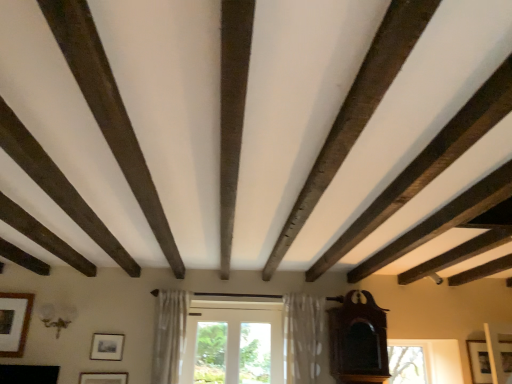
Question: From a real-world perspective, does matte gold picture frame at lower center, which ranks as the third picture frame in left-to-right order, sit lower than mahogany wood grandfather clock at right?

Choices:
 (A) no
 (B) yes

Answer: (B)

Question: From a real-world perspective, is matte gold picture frame at lower center, the 2th picture frame from the right, on mahogany wood grandfather clock at right?

Choices:
 (A) no
 (B) yes

Answer: (A)

Question: Does matte gold picture frame at lower center, the 2th picture frame from the right, come behind mahogany wood grandfather clock at right?

Choices:
 (A) no
 (B) yes

Answer: (B)

Question: Can you confirm if matte gold picture frame at lower center, the 2th picture frame from the right, is positioned to the left of mahogany wood grandfather clock at right?

Choices:
 (A) yes
 (B) no

Answer: (A)

Question: Would you say matte gold picture frame at lower center, which ranks as the third picture frame in left-to-right order, is outside mahogany wood grandfather clock at right?

Choices:
 (A) no
 (B) yes

Answer: (B)

Question: Considering the positions of matte black picture frame at center, the second picture frame viewed from the left, and matte gold picture frame at lower center, which ranks as the third picture frame in left-to-right order, in the image, is matte black picture frame at center, the second picture frame viewed from the left, wider or thinner than matte gold picture frame at lower center, which ranks as the third picture frame in left-to-right order,?

Choices:
 (A) thin
 (B) wide

Answer: (A)

Question: Considering the positions of point (95, 344) and point (96, 374), is point (95, 344) closer or farther from the camera than point (96, 374)?

Choices:
 (A) closer
 (B) farther

Answer: (B)

Question: From a real-world perspective, relative to matte gold picture frame at lower center, the 2th picture frame from the right, is matte black picture frame at center, marked as the third picture frame in a right-to-left arrangement, vertically above or below?

Choices:
 (A) above
 (B) below

Answer: (A)

Question: In the image, is matte black picture frame at center, the second picture frame viewed from the left, positioned in front of or behind matte gold picture frame at lower center, the 2th picture frame from the right?

Choices:
 (A) behind
 (B) front

Answer: (A)

Question: From the image's perspective, is wooden picture frame at lower left, which is the first picture frame in left-to-right order, above or below wooden picture frame at lower right, which is the fourth picture frame in left-to-right order?

Choices:
 (A) below
 (B) above

Answer: (B)

Question: From a real-world perspective, relative to wooden picture frame at lower right, which appears as the first picture frame when viewed from the right, is wooden picture frame at lower left, which is the 4th picture frame in right-to-left order, vertically above or below?

Choices:
 (A) below
 (B) above

Answer: (B)

Question: Considering the positions of point (19, 334) and point (466, 342), is point (19, 334) closer or farther from the camera than point (466, 342)?

Choices:
 (A) farther
 (B) closer

Answer: (B)

Question: Looking at their shapes, would you say wooden picture frame at lower left, which is the first picture frame in left-to-right order, is wider or thinner than wooden picture frame at lower right, which appears as the first picture frame when viewed from the right?

Choices:
 (A) wide
 (B) thin

Answer: (A)

Question: From a real-world perspective, is mahogany wood grandfather clock at right physically located above or below matte black picture frame at center, the second picture frame viewed from the left?

Choices:
 (A) below
 (B) above

Answer: (B)

Question: From the image's perspective, is mahogany wood grandfather clock at right above or below matte black picture frame at center, marked as the third picture frame in a right-to-left arrangement?

Choices:
 (A) above
 (B) below

Answer: (A)